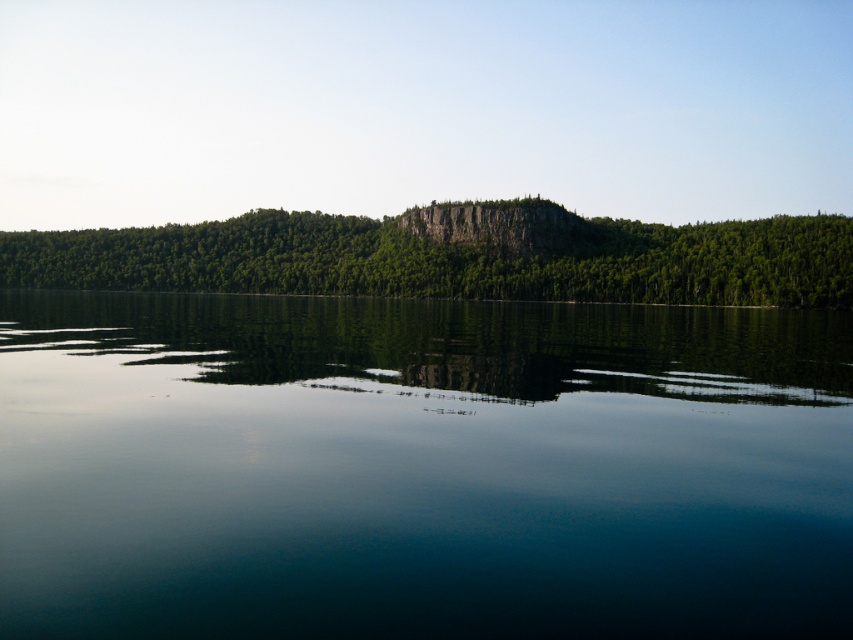
Question: Is transparent glass water at center further to camera compared to rocky cliff at center?

Choices:
 (A) yes
 (B) no

Answer: (B)

Question: Does green leafy trees at center lie behind rocky cliff at center?

Choices:
 (A) no
 (B) yes

Answer: (A)

Question: Which point is closer to the camera?

Choices:
 (A) transparent glass water at center
 (B) green leafy trees at center

Answer: (A)

Question: Does green leafy trees at center have a lesser width compared to rocky cliff at center?

Choices:
 (A) yes
 (B) no

Answer: (B)

Question: Which point is farther from the camera taking this photo?

Choices:
 (A) (532, 205)
 (B) (838, 253)

Answer: (A)

Question: Which object is farther from the camera taking this photo?

Choices:
 (A) rocky cliff at center
 (B) green leafy trees at center
 (C) transparent glass water at center

Answer: (A)